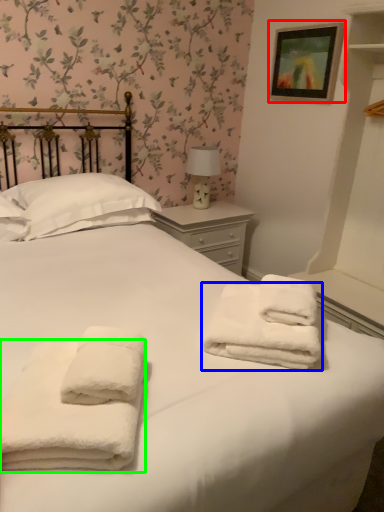
Question: Estimate the real-world distances between objects in this image. Which object is closer to picture frame (highlighted by a red box), towel (highlighted by a blue box) or towel (highlighted by a green box)?

Choices:
 (A) towel
 (B) towel

Answer: (A)